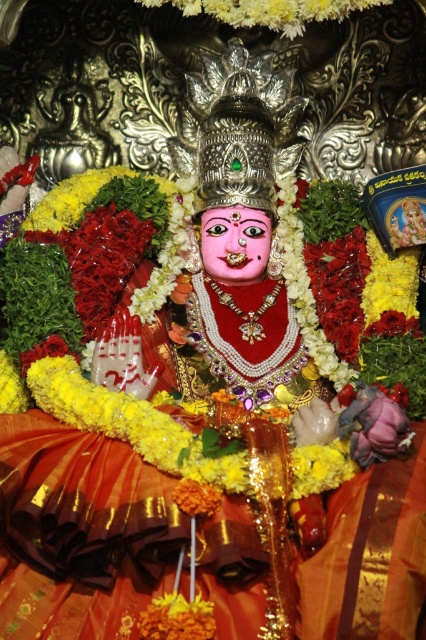
Question: Which point appears farthest from the camera in this image?

Choices:
 (A) (391, 429)
 (B) (296, 26)

Answer: (B)

Question: Is yellow fabric at upper center above yellow fabric flower at lower right?

Choices:
 (A) yes
 (B) no

Answer: (A)

Question: Among these points, which one is farthest from the camera?

Choices:
 (A) (222, 17)
 (B) (367, 432)

Answer: (A)

Question: Is yellow fabric at upper center bigger than yellow fabric flower at lower right?

Choices:
 (A) yes
 (B) no

Answer: (A)

Question: Is yellow fabric at upper center closer to camera compared to yellow fabric flower at lower right?

Choices:
 (A) yes
 (B) no

Answer: (B)

Question: Which point is farther from the camera taking this photo?

Choices:
 (A) (345, 390)
 (B) (146, 1)

Answer: (B)